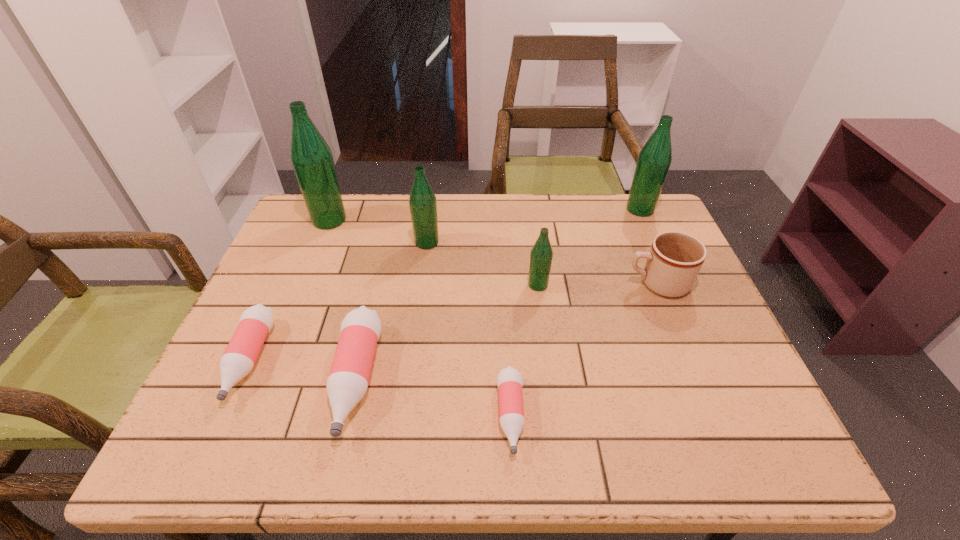
Where is `free space located 0.220m on the side of the mug with the handle`? The image size is (960, 540). free space located 0.220m on the side of the mug with the handle is located at coordinates (540, 284).

Locate an element on the screen. The image size is (960, 540). vacant space located 0.270m on the side of the mug with the handle is located at coordinates (521, 284).

The image size is (960, 540). I want to click on vacant space situated 0.090m on the side of the mug with the handle, so click(590, 284).

You are a GUI agent. You are given a task and a screenshot of the screen. Output one action in this format:
    pyautogui.click(x=<x>, y=<y>)
    Task: Click on the vacant area situated 0.080m with the cap open on the second shortest object
    The width and height of the screenshot is (960, 540).
    Given the screenshot: What is the action you would take?
    pyautogui.click(x=209, y=448)

Find the location of a particular element. The image size is (960, 540). bottle positioned at the right edge is located at coordinates (654, 160).

The width and height of the screenshot is (960, 540). Find the location of `mug that is positioned at the right edge`. mug that is positioned at the right edge is located at coordinates (675, 258).

This screenshot has width=960, height=540. Find the location of `object that is at the far left corner`. object that is at the far left corner is located at coordinates (311, 158).

Find the location of a particular element. The image size is (960, 540). object that is positioned at the far right corner is located at coordinates (654, 160).

In the image, there is a desktop. Where is `vacant space at the far edge`? This screenshot has width=960, height=540. vacant space at the far edge is located at coordinates (530, 204).

Where is `vacant area at the left edge`? vacant area at the left edge is located at coordinates (312, 289).